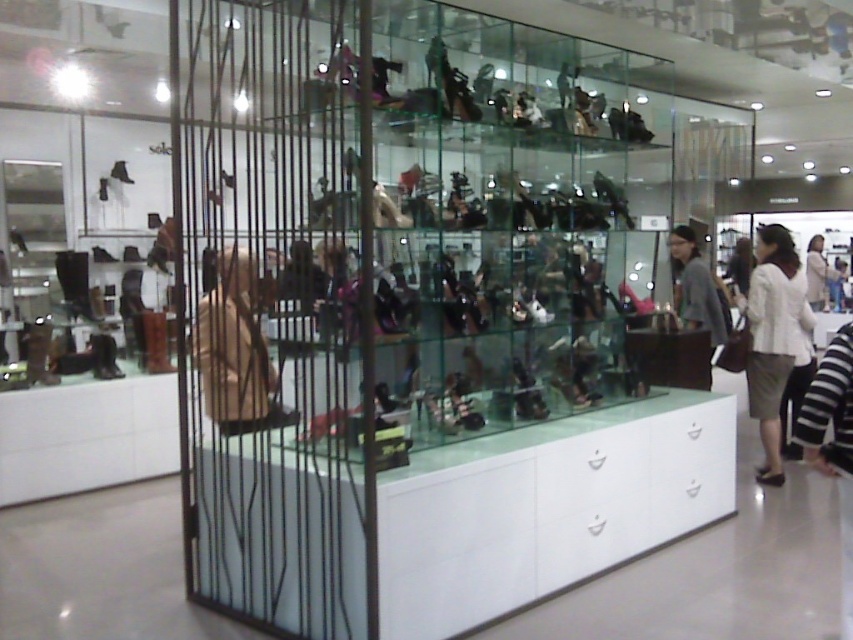
Question: Does white fabric skirt at lower right come in front of gray fabric jacket at center?

Choices:
 (A) no
 (B) yes

Answer: (B)

Question: Considering the relative positions of white fabric skirt at lower right and gray fabric jacket at center in the image provided, where is white fabric skirt at lower right located with respect to gray fabric jacket at center?

Choices:
 (A) left
 (B) right

Answer: (B)

Question: Which point is closer to the camera?

Choices:
 (A) (686, 305)
 (B) (782, 308)

Answer: (B)

Question: Which point is closer to the camera taking this photo?

Choices:
 (A) (714, 339)
 (B) (778, 310)

Answer: (B)

Question: Can you confirm if white fabric skirt at lower right is positioned below gray fabric jacket at center?

Choices:
 (A) yes
 (B) no

Answer: (A)

Question: Among these objects, which one is farthest from the camera?

Choices:
 (A) gray fabric jacket at center
 (B) white fabric skirt at lower right

Answer: (A)